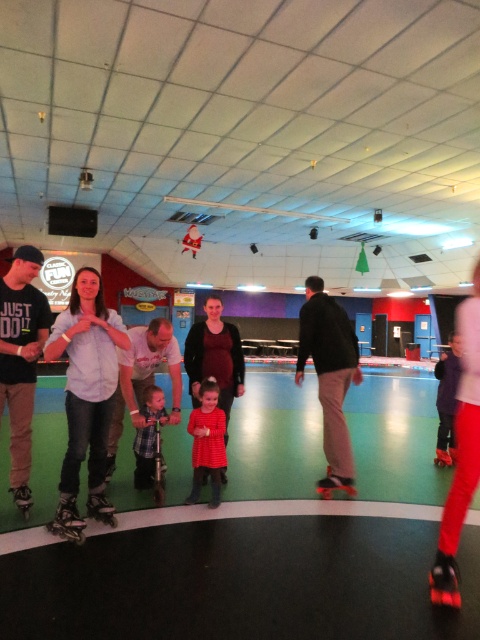
Question: Can you confirm if shiny black roller skate at lower left is smaller than black matte roller skate at lower right?

Choices:
 (A) no
 (B) yes

Answer: (A)

Question: Which object is farther from the camera taking this photo?

Choices:
 (A) shiny silver roller skate at lower left
 (B) matte blue shirt at center
 (C) matte black roller skate at lower left

Answer: (C)

Question: Is matte brown skateboard at center further to the viewer compared to black matte roller skate at lower center?

Choices:
 (A) no
 (B) yes

Answer: (A)

Question: Is black matte shirt at left positioned at the back of black matte roller skate at lower right?

Choices:
 (A) no
 (B) yes

Answer: (A)

Question: Which point is farther from the camera taking this photo?

Choices:
 (A) (1, 314)
 (B) (349, 481)
 (C) (444, 454)

Answer: (C)

Question: Estimate the real-world distances between objects in this image. Which object is closer to the shiny red roller skates at lower right?

Choices:
 (A) plaid shirt at center
 (B) black matte roller skate at lower center
 (C) shiny silver roller skate at lower left

Answer: (B)